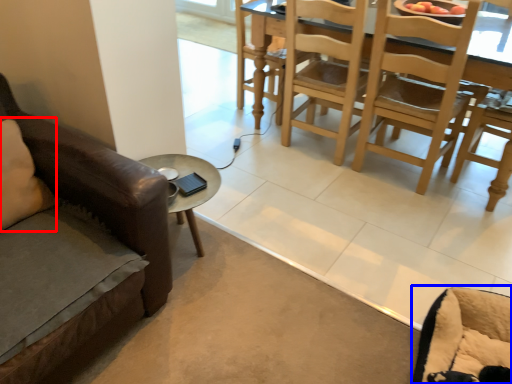
Question: Which object appears closest to the camera in this image, pillow (highlighted by a red box) or swivel chair (highlighted by a blue box)?

Choices:
 (A) pillow
 (B) swivel chair

Answer: (B)